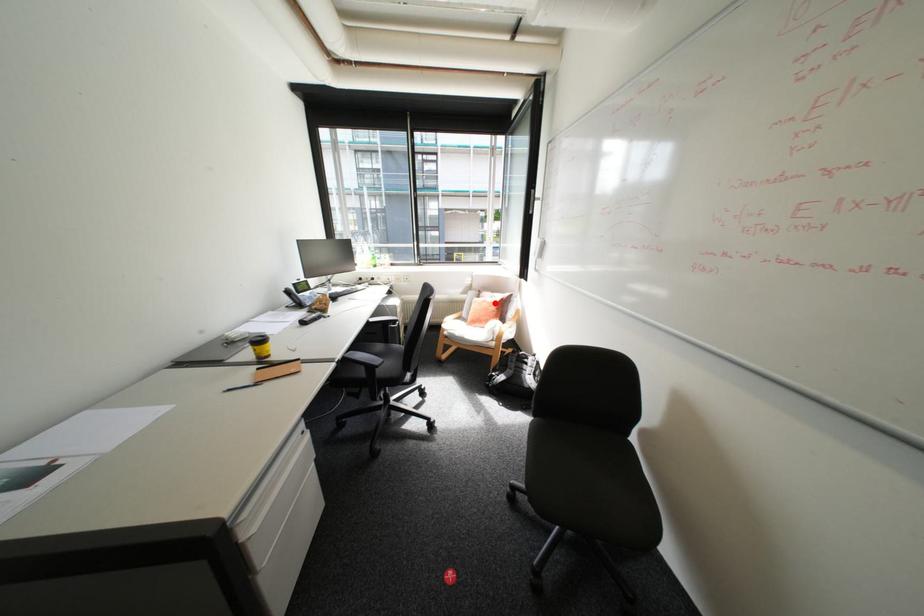
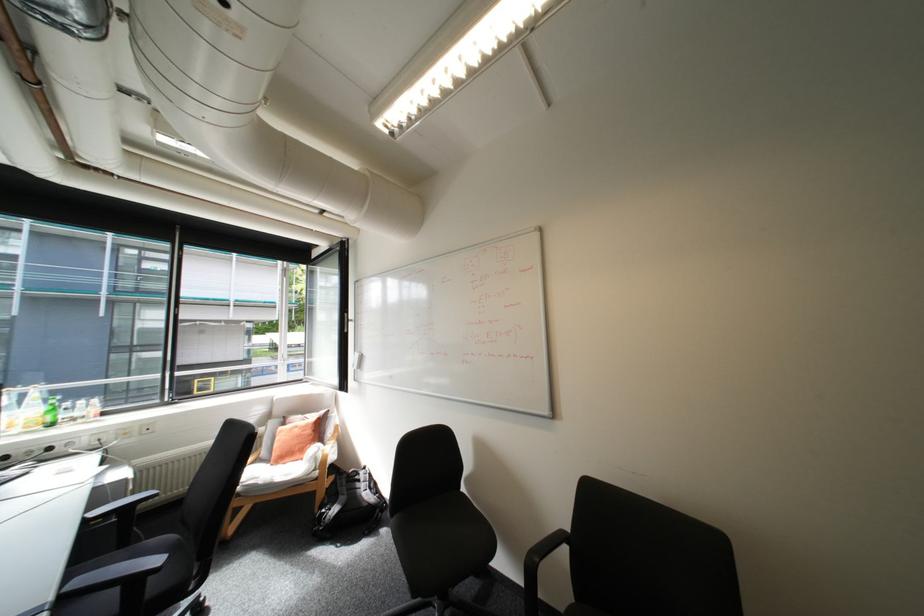
Question: A red point is marked in image1. In image2, is the corresponding 3D point closer to the camera or farther? Reply with the corresponding letter.

Choices:
 (A) The corresponding 3D point is closer.
 (B) The corresponding 3D point is farther.

Answer: (B)